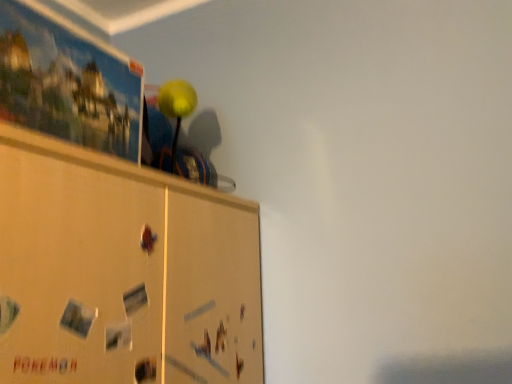
Describe the element at coordinates (67, 82) in the screenshot. This screenshot has height=384, width=512. I see `matte paper poster at upper left` at that location.

Image resolution: width=512 pixels, height=384 pixels. I want to click on matte paper poster at upper left, so click(x=67, y=82).

Find the location of a particular element. Image resolution: width=512 pixels, height=384 pixels. matte paper poster at upper left is located at coordinates (67, 82).